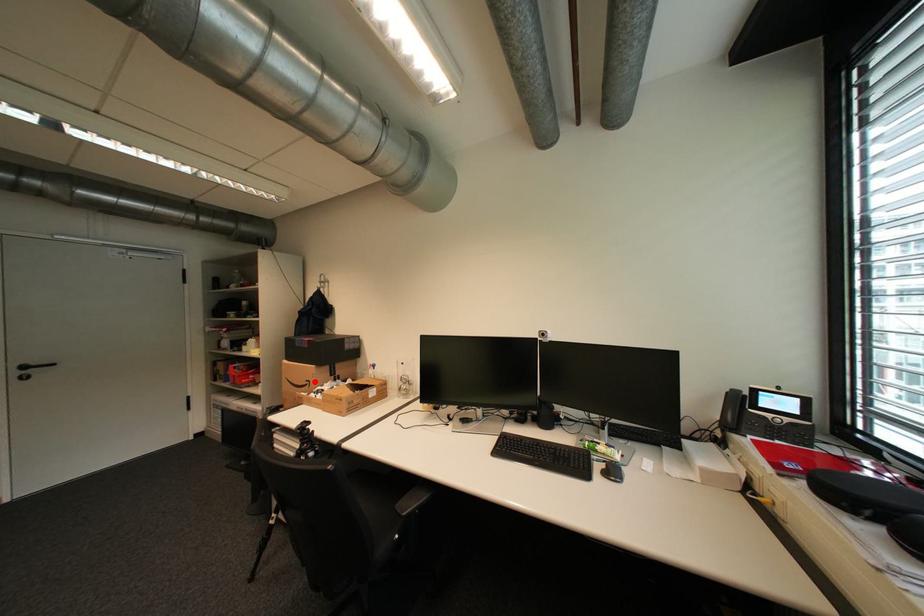
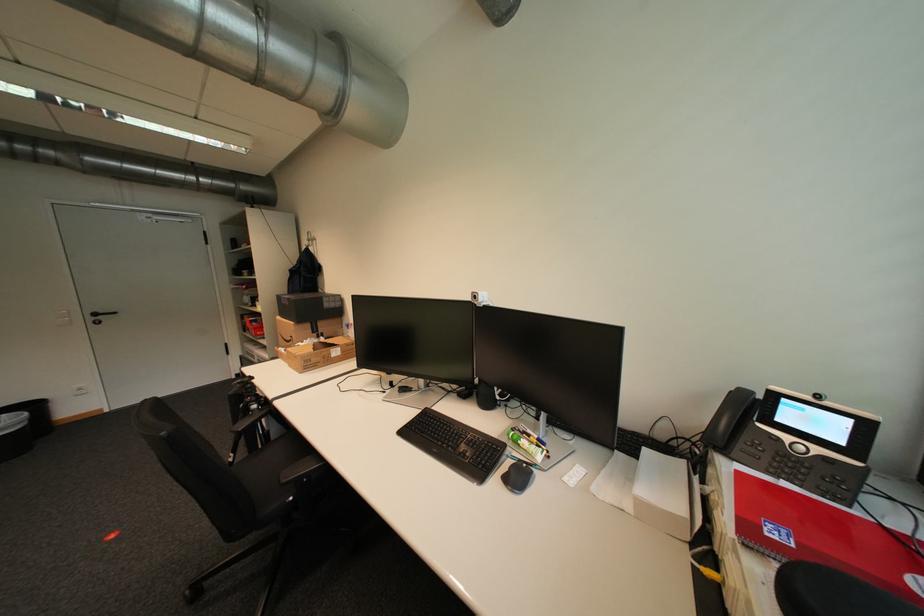
In the second image, find the point that corresponds to the highlighted location in the first image.

(299, 338)